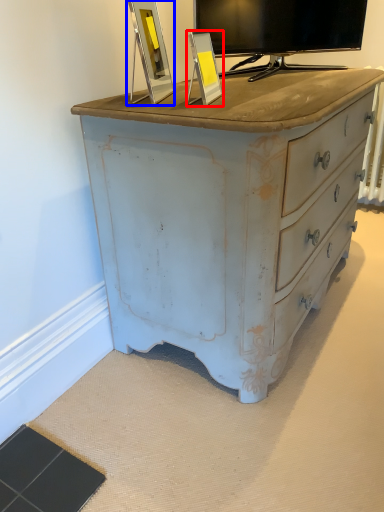
Question: Among these objects, which one is farthest to the camera, picture frame (highlighted by a red box) or picture frame (highlighted by a blue box)?

Choices:
 (A) picture frame
 (B) picture frame

Answer: (A)